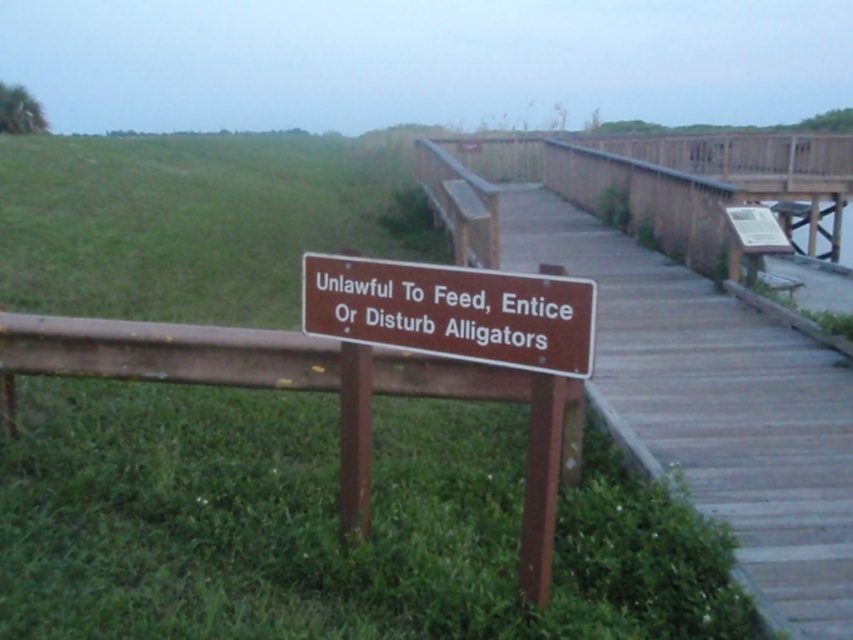
Question: Considering the real-world distances, which object is farthest from the brown wooden sign at center?

Choices:
 (A) brown wooden dock at center
 (B) wooden bench at upper right

Answer: (B)

Question: Which point is farther to the camera?

Choices:
 (A) (793, 289)
 (B) (554, 353)

Answer: (A)

Question: Does brown wooden sign at center have a greater width compared to wooden bench at upper right?

Choices:
 (A) yes
 (B) no

Answer: (A)

Question: Which of the following is the closest to the observer?

Choices:
 (A) (325, 284)
 (B) (508, 192)

Answer: (A)

Question: Can you confirm if brown wooden dock at center is thinner than brown wooden sign at center?

Choices:
 (A) yes
 (B) no

Answer: (B)

Question: Is brown wooden dock at center positioned behind wooden bench at upper right?

Choices:
 (A) no
 (B) yes

Answer: (A)